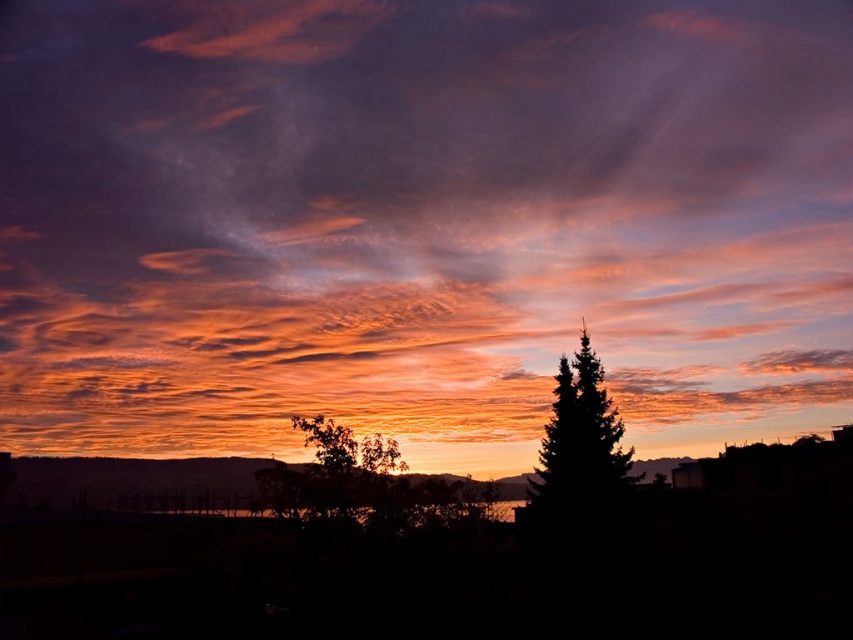
Question: Which object is the closest to the green leafy tree at center?

Choices:
 (A) silhouette fir tree at right
 (B) orange translucent cloud at center

Answer: (A)

Question: Can you confirm if orange translucent cloud at center is bigger than green leafy tree at center?

Choices:
 (A) yes
 (B) no

Answer: (A)

Question: Which of these objects is positioned farthest from the green leafy tree at center?

Choices:
 (A) silhouette fir tree at right
 (B) orange translucent cloud at center

Answer: (B)

Question: Among these points, which one is nearest to the camera?

Choices:
 (A) (294, 195)
 (B) (292, 500)
 (C) (604, 506)

Answer: (B)

Question: Does orange translucent cloud at center appear over silhouette fir tree at right?

Choices:
 (A) yes
 (B) no

Answer: (A)

Question: Does silhouette fir tree at right come in front of green leafy tree at center?

Choices:
 (A) no
 (B) yes

Answer: (A)